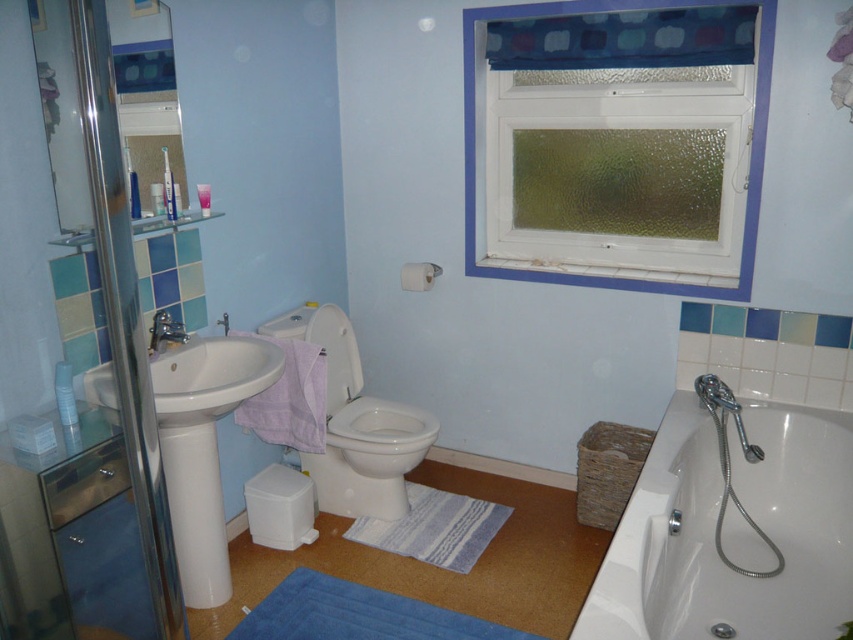
Question: Which object is the farthest from the white glossy bathtub at lower right?

Choices:
 (A) transparent glass shower door at left
 (B) white glossy toilet bowl at center
 (C) textured glass window at upper right

Answer: (A)

Question: Does textured glass window at upper right appear on the right side of blue striped bath mat at center?

Choices:
 (A) no
 (B) yes

Answer: (B)

Question: Among these points, which one is nearest to the camera?

Choices:
 (A) (0, 589)
 (B) (490, 8)

Answer: (A)

Question: Can you confirm if transparent glass shower door at left is smaller than blue plush bath mat at lower center?

Choices:
 (A) yes
 (B) no

Answer: (B)

Question: Estimate the real-world distances between objects in this image. Which object is closer to the textured glass window at upper right?

Choices:
 (A) transparent glass shower door at left
 (B) white glossy toilet bowl at center
 (C) white glossy bathtub at lower right
 (D) blue striped bath mat at center

Answer: (B)

Question: Is textured glass window at upper right below blue plush bath mat at lower center?

Choices:
 (A) no
 (B) yes

Answer: (A)